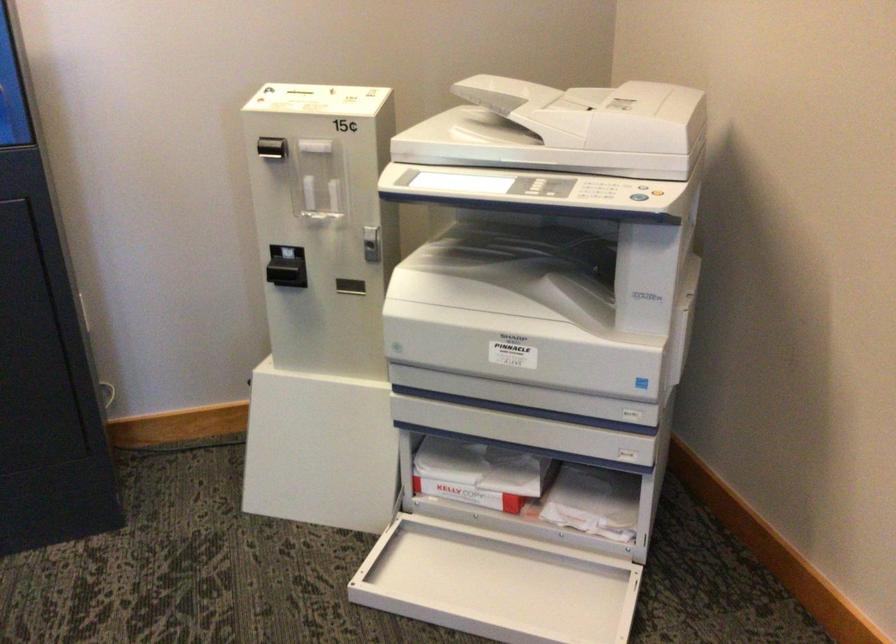
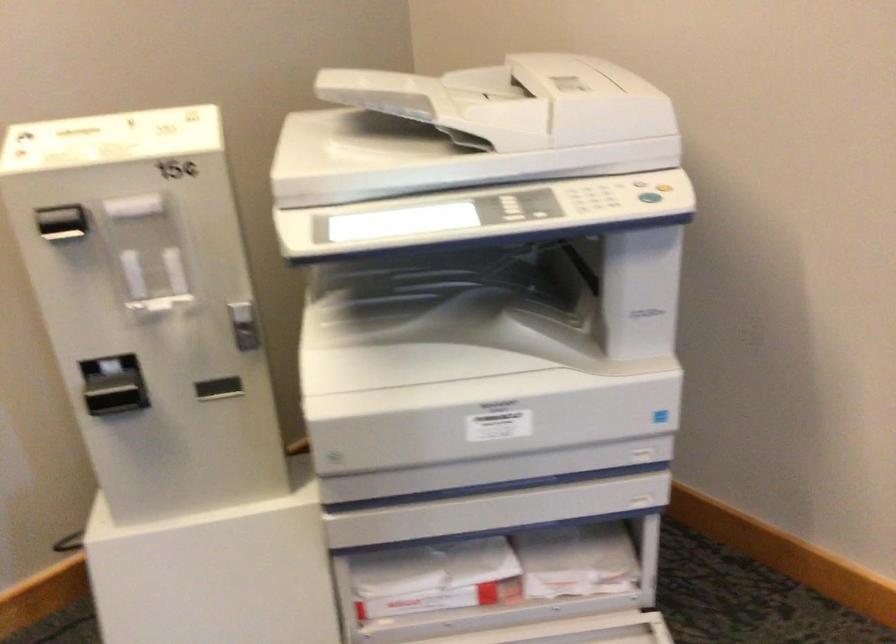
Question: The camera is either moving clockwise (left) or counter-clockwise (right) around the object. The first image is from the beginning of the video and the second image is from the end. Is the camera moving left or right when shooting the video?

Choices:
 (A) Left
 (B) Right

Answer: (A)